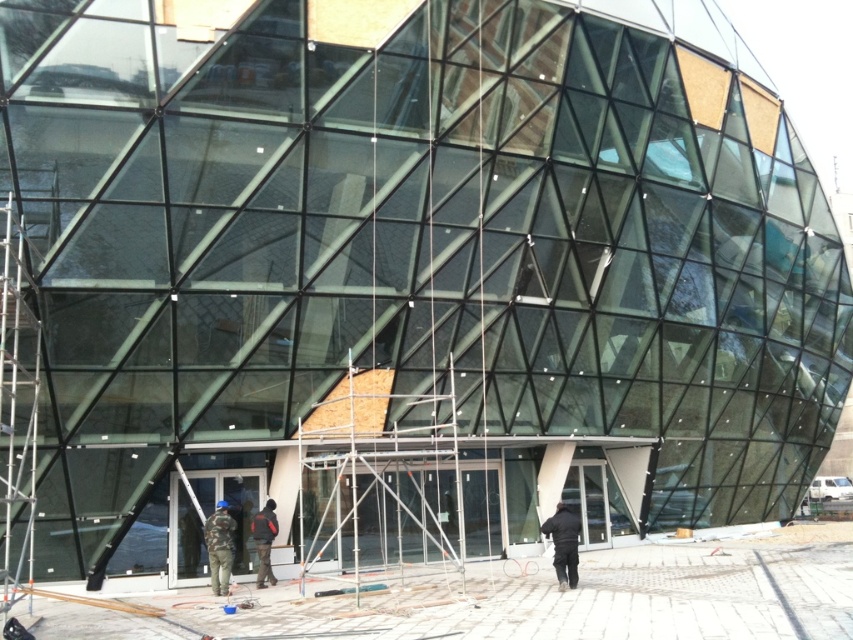
Is the position of black matte jacket at lower center less distant than that of dark blue jacket at center?

That is True.

Which is behind, point (561, 541) or point (260, 586)?

Point (260, 586)

At what (x,y) coordinates should I click in order to perform the action: click on black matte jacket at lower center. Please return your answer as a coordinate pair (x, y). Looking at the image, I should click on (563, 544).

This screenshot has width=853, height=640. I want to click on black matte jacket at lower center, so click(563, 544).

Does black matte jacket at lower center lie behind camouflage fabric jacket at lower center?

No, black matte jacket at lower center is in front of camouflage fabric jacket at lower center.

Which is above, black matte jacket at lower center or camouflage fabric jacket at lower center?

black matte jacket at lower center is above.

Between point (558, 572) and point (216, 529), which one is positioned behind?

The point (216, 529) is behind.

I want to click on black matte jacket at lower center, so click(563, 544).

Based on the photo, does camouflage fabric jacket at lower center have a smaller size compared to dark blue jacket at center?

No, camouflage fabric jacket at lower center is not smaller than dark blue jacket at center.

Looking at this image, can you confirm if camouflage fabric jacket at lower center is shorter than dark blue jacket at center?

Indeed, camouflage fabric jacket at lower center has a lesser height compared to dark blue jacket at center.

Between point (231, 525) and point (256, 522), which one is positioned behind?

Point (256, 522)

This screenshot has width=853, height=640. I want to click on camouflage fabric jacket at lower center, so click(x=219, y=547).